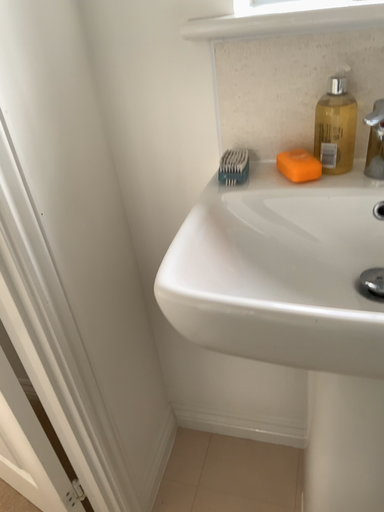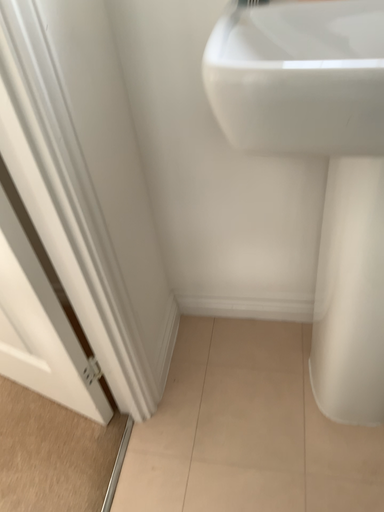
Question: How did the camera likely rotate when shooting the video?

Choices:
 (A) rotated upward
 (B) rotated downward

Answer: (B)